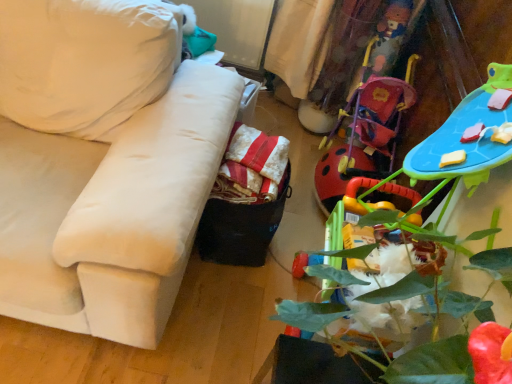
Question: Can you confirm if green leafy plant at lower right is thinner than velvet white couch at left?

Choices:
 (A) yes
 (B) no

Answer: (A)

Question: Can you confirm if green leafy plant at lower right is shorter than velvet white couch at left?

Choices:
 (A) yes
 (B) no

Answer: (B)

Question: Does green leafy plant at lower right have a larger size compared to velvet white couch at left?

Choices:
 (A) no
 (B) yes

Answer: (A)

Question: Considering the relative sizes of green leafy plant at lower right and velvet white couch at left in the image provided, is green leafy plant at lower right taller than velvet white couch at left?

Choices:
 (A) yes
 (B) no

Answer: (A)

Question: From the image's perspective, is green leafy plant at lower right beneath velvet white couch at left?

Choices:
 (A) yes
 (B) no

Answer: (A)

Question: Considering the relative sizes of green leafy plant at lower right and velvet white couch at left in the image provided, is green leafy plant at lower right wider than velvet white couch at left?

Choices:
 (A) yes
 (B) no

Answer: (B)

Question: Is red striped fabric at center outside of velvet white couch at left?

Choices:
 (A) no
 (B) yes

Answer: (B)

Question: Does red striped fabric at center have a smaller size compared to velvet white couch at left?

Choices:
 (A) yes
 (B) no

Answer: (A)

Question: Could you tell me if red striped fabric at center is facing velvet white couch at left?

Choices:
 (A) yes
 (B) no

Answer: (B)

Question: Can you confirm if red striped fabric at center is thinner than velvet white couch at left?

Choices:
 (A) no
 (B) yes

Answer: (B)

Question: From a real-world perspective, is red striped fabric at center located higher than velvet white couch at left?

Choices:
 (A) no
 (B) yes

Answer: (A)

Question: Is red striped fabric at center positioned before velvet white couch at left?

Choices:
 (A) yes
 (B) no

Answer: (B)

Question: Is velvet white couch at left thinner than red striped fabric at center?

Choices:
 (A) no
 (B) yes

Answer: (A)